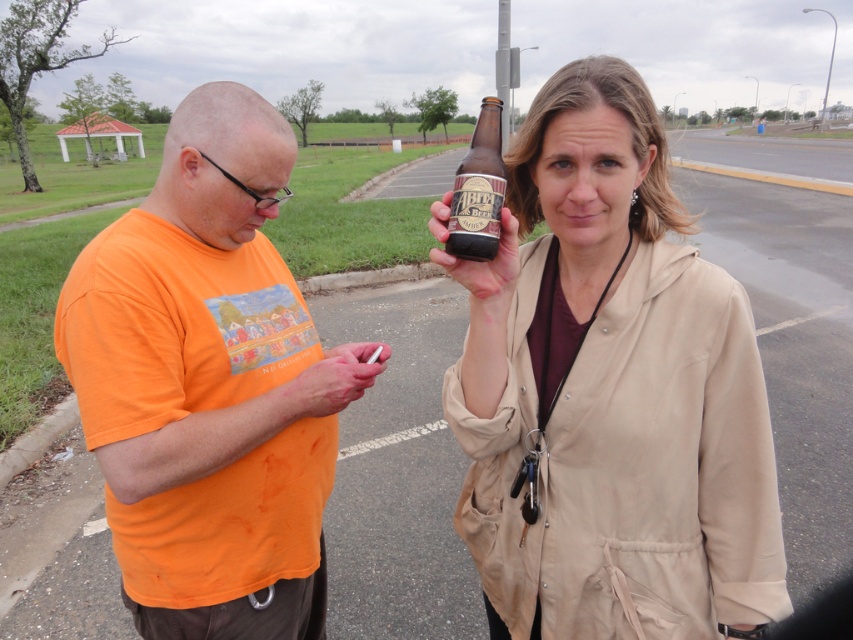
You are a delivery person who needs to place two bottles on a shelf. The shelf has a height limit of 12 inches. You have a matte brown bottle at center and a brown glass bottle at center. Which bottle will exceed the height limit?

The matte brown bottle at center is much taller than the brown glass bottle at center. Since the shelf has a height limit of 12 inches, the matte brown bottle at center may exceed the limit while the brown glass bottle at center likely fits within it.

From the picture: Please describe the position of the orange cotton shirt at center in terms of coordinates in the image. The image has a coordinate system where the origin is at the bottom left corner, with the x and y axes increasing to the right and up respectively. The coordinates are normalized between 0 and 1. You must use the exact object label from the Objects section in your answer.

The orange cotton shirt at center is located at coordinates x 0.603 and y 0.246 in the image.

You are a photographer standing at the camera position. You want to take a closeup shot of the matte brown bottle at center. Do you think you can move closer to the bottle without exceeding the legal distance limit of 36 inches? Please explain your reasoning.

The matte brown bottle at center and camera are 37.49 inches apart. Since the legal distance limit is 36 inches, moving closer would exceed the limit. Therefore, you cannot move closer without violating the regulation.